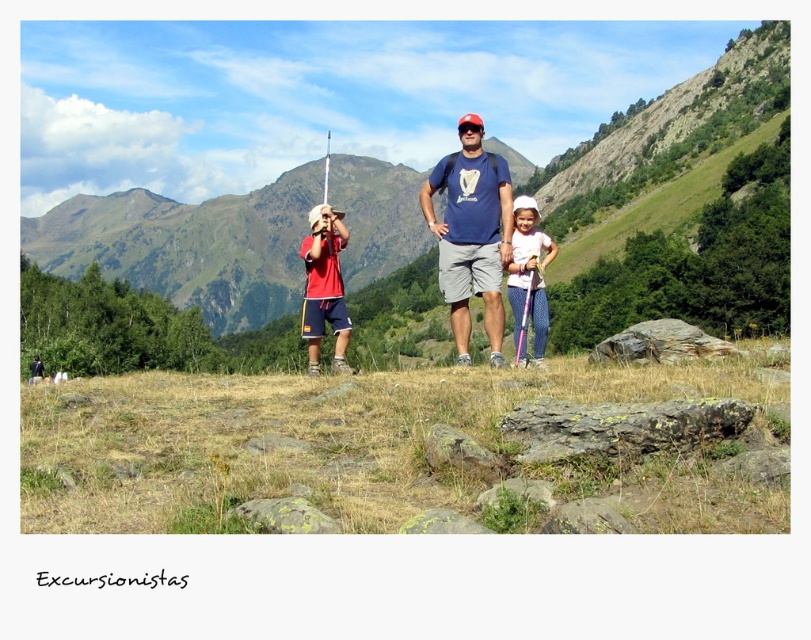
Is point (719, 129) closer to camera compared to point (470, 195)?

No, it is not.

Which of these two, green grassy mountain at center or blue t-shirt at center, stands taller?

With more height is green grassy mountain at center.

The width and height of the screenshot is (811, 640). I want to click on green grassy mountain at center, so [x=187, y=244].

Consider the image. Does blue t-shirt at center appear under pink fabric dress at center?

Correct, blue t-shirt at center is located below pink fabric dress at center.

Is blue t-shirt at center further to camera compared to pink fabric dress at center?

No.

Locate an element on the screen. blue t-shirt at center is located at coordinates (x=471, y=234).

Is green grassy mountain at center to the right of pink fabric dress at center from the viewer's perspective?

No, green grassy mountain at center is not to the right of pink fabric dress at center.

Is green grassy mountain at center positioned before pink fabric dress at center?

No, green grassy mountain at center is further to the viewer.

Is point (262, 259) positioned before point (524, 301)?

That is False.

The height and width of the screenshot is (640, 811). I want to click on green grassy mountain at center, so click(x=187, y=244).